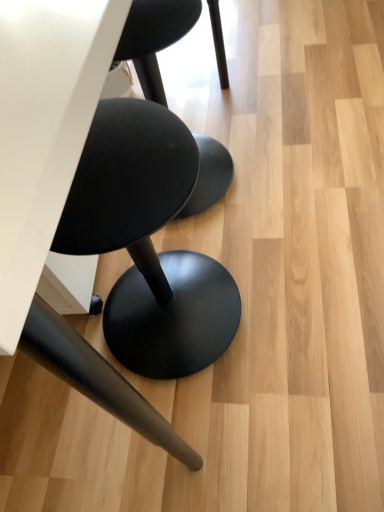
Locate an element on the screen. The width and height of the screenshot is (384, 512). matte black table at lower left is located at coordinates (56, 186).

What do you see at coordinates (56, 186) in the screenshot?
I see `matte black table at lower left` at bounding box center [56, 186].

I want to click on matte black table at lower left, so click(56, 186).